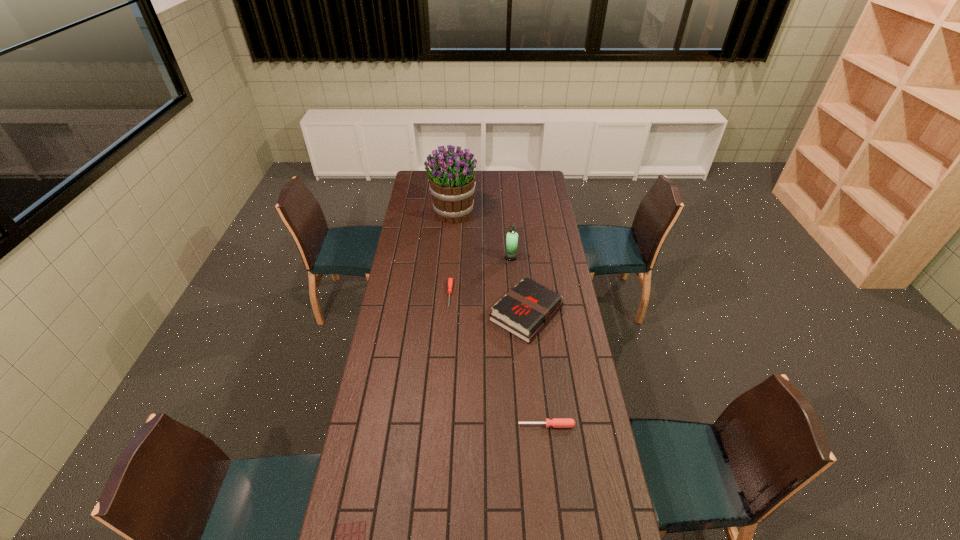
What are the coordinates of `vacant space located 0.230m on the left of the thermos bottle` in the screenshot? It's located at (459, 258).

Where is `free space located 0.160m on the back of the hardback book`? This screenshot has height=540, width=960. free space located 0.160m on the back of the hardback book is located at coordinates (521, 264).

Identify the location of vacant space located on the left of the taller screwdriver. This screenshot has height=540, width=960. (464, 425).

You are a GUI agent. You are given a task and a screenshot of the screen. Output one action in this format:
    pyautogui.click(x=<x>, y=<y>)
    Task: Click on the blank area located 0.050m at the tip of the shorter screwdriver
    The image size is (960, 540).
    Given the screenshot: What is the action you would take?
    click(448, 317)

The image size is (960, 540). I want to click on object at the left edge, so click(452, 181).

Locate an element on the screen. Image resolution: width=960 pixels, height=540 pixels. hardback book situated at the right edge is located at coordinates (527, 308).

The image size is (960, 540). I want to click on screwdriver at the right edge, so click(x=555, y=422).

Image resolution: width=960 pixels, height=540 pixels. In the image, there is a desktop. Find the location of `free space at the left edge`. free space at the left edge is located at coordinates tap(378, 420).

What are the coordinates of `blank space at the right edge of the desktop` in the screenshot? It's located at (564, 251).

Where is `free space at the far right corner of the desktop`? This screenshot has width=960, height=540. free space at the far right corner of the desktop is located at coordinates (535, 172).